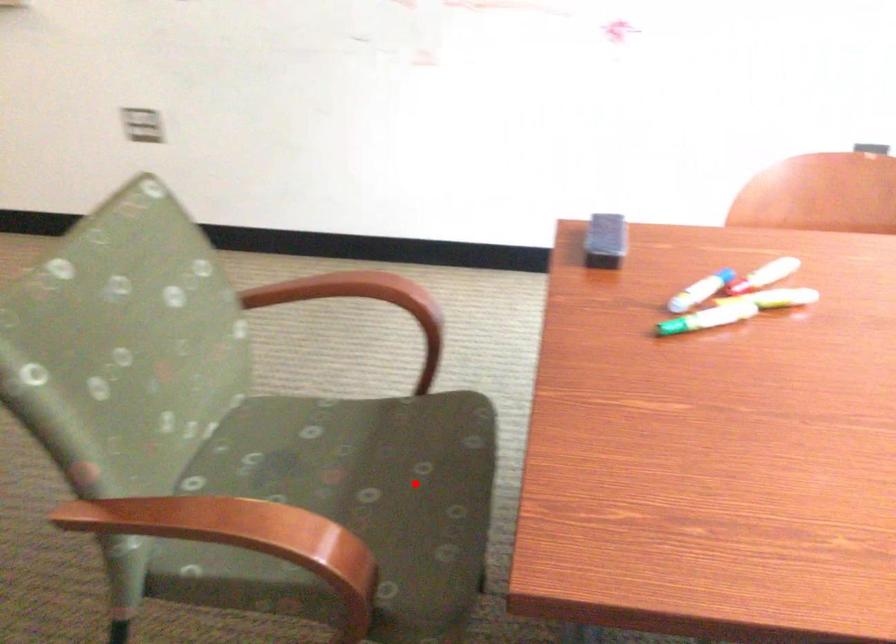
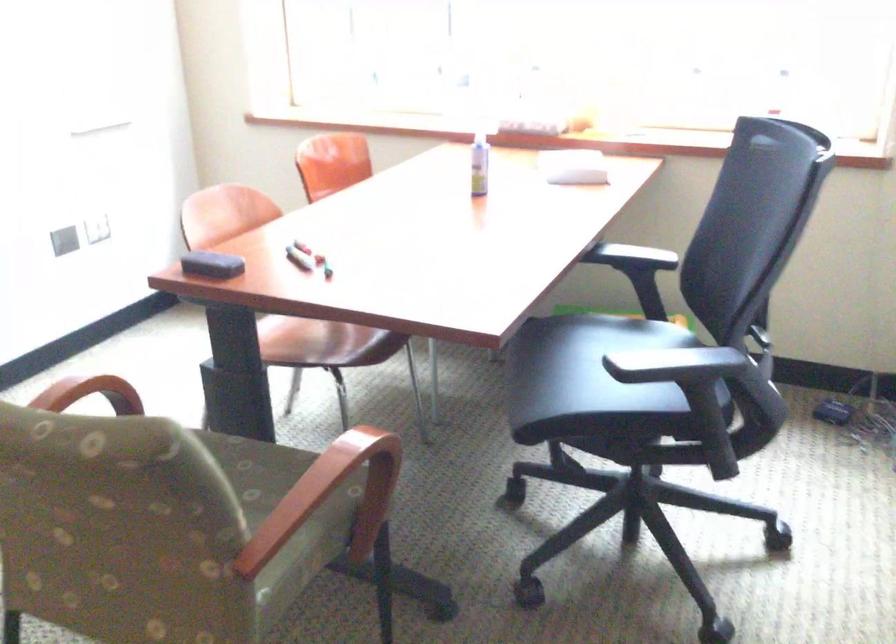
In the second image, find the point that corresponds to the highlighted location in the first image.

(251, 469)